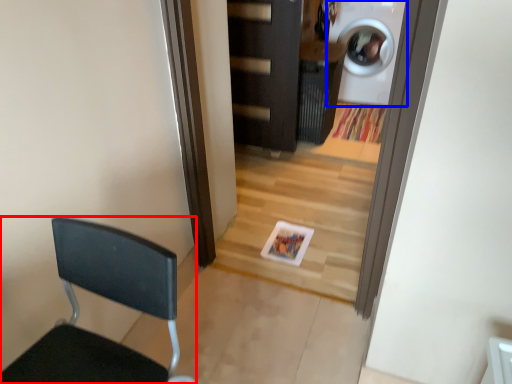
Question: Which object appears farthest to the camera in this image, chair (highlighted by a red box) or washing machine (highlighted by a blue box)?

Choices:
 (A) chair
 (B) washing machine

Answer: (B)